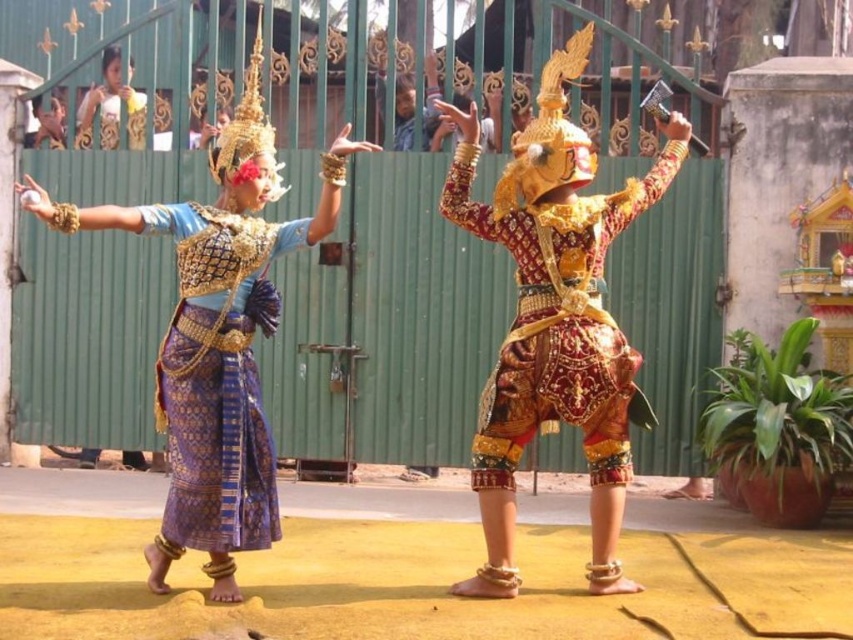
Is gold textured fabric costume at center to the right of blue silk skirt at left from the viewer's perspective?

Correct, you'll find gold textured fabric costume at center to the right of blue silk skirt at left.

Between gold textured fabric costume at center and blue silk skirt at left, which one is positioned higher?

gold textured fabric costume at center

The image size is (853, 640). What are the coordinates of `gold textured fabric costume at center` in the screenshot? It's located at (558, 323).